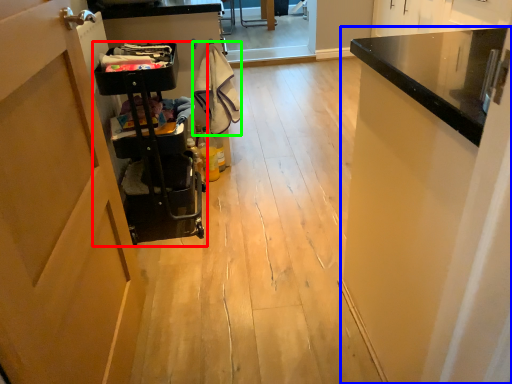
Question: Which is nearer to the trolley (highlighted by a red box)? cabinetry (highlighted by a blue box) or laundry (highlighted by a green box).

Choices:
 (A) cabinetry
 (B) laundry

Answer: (B)